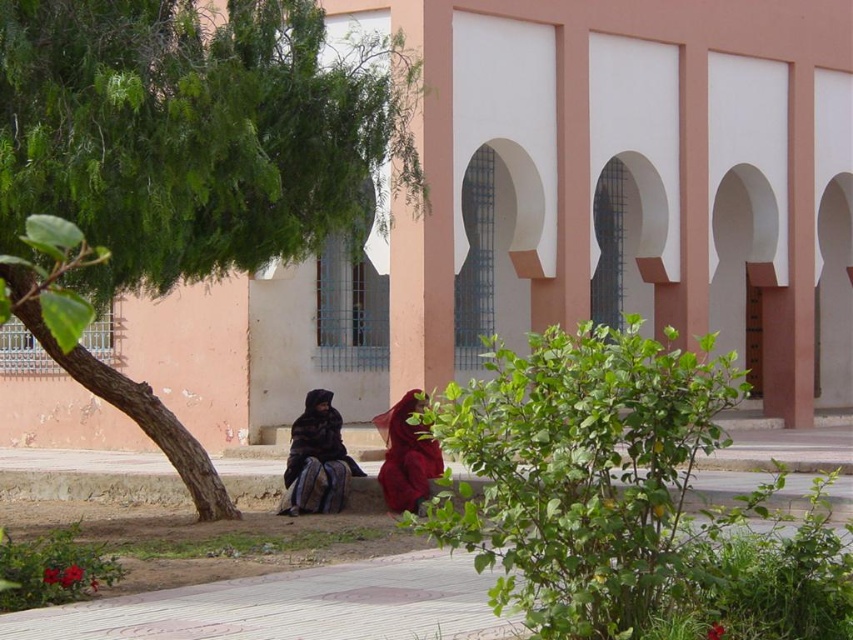
Looking at this image, which is more to the left, dark brown textured fabric at center or matte red dress at lower center?

dark brown textured fabric at center

What do you see at coordinates (316, 460) in the screenshot? I see `dark brown textured fabric at center` at bounding box center [316, 460].

Is point (332, 410) closer to viewer compared to point (399, 490)?

No, (332, 410) is behind (399, 490).

This screenshot has height=640, width=853. Find the location of `dark brown textured fabric at center`. dark brown textured fabric at center is located at coordinates (316, 460).

Can you confirm if green leafy tree at left is thinner than matte red dress at lower center?

No, green leafy tree at left is not thinner than matte red dress at lower center.

Is green leafy tree at left taller than matte red dress at lower center?

Yes, green leafy tree at left is taller than matte red dress at lower center.

Locate an element on the screen. green leafy tree at left is located at coordinates (195, 134).

Does point (213, 80) come farther from viewer compared to point (300, 467)?

No, (213, 80) is closer to viewer.

Between green leafy tree at left and dark brown textured fabric at center, which one is positioned lower?

Positioned lower is dark brown textured fabric at center.

The height and width of the screenshot is (640, 853). What do you see at coordinates (195, 134) in the screenshot?
I see `green leafy tree at left` at bounding box center [195, 134].

The width and height of the screenshot is (853, 640). Find the location of `green leafy tree at left`. green leafy tree at left is located at coordinates (195, 134).